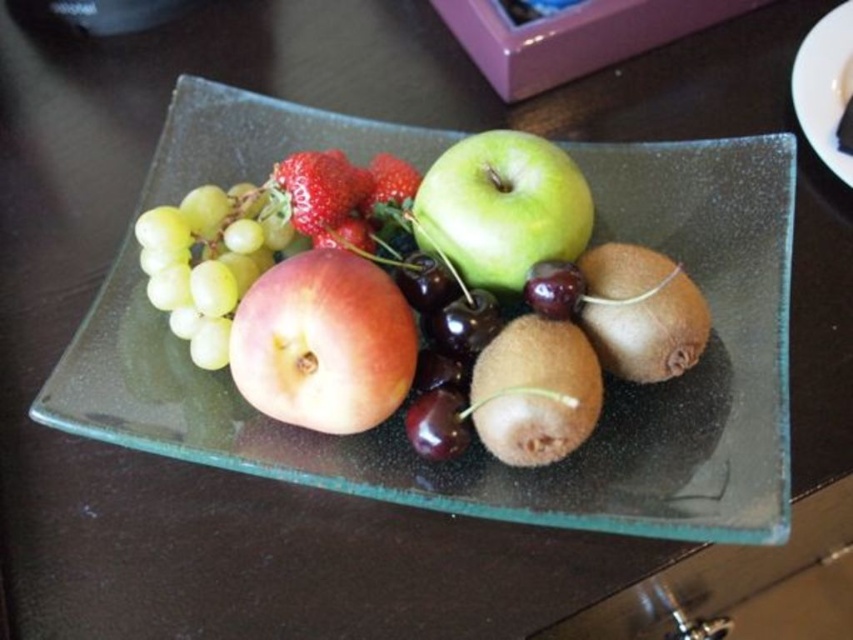
How distant is transparent glass platter at center from white glossy plate at upper right?

They are 15.37 inches apart.

Can you confirm if transparent glass platter at center is positioned above white glossy plate at upper right?

Actually, transparent glass platter at center is below white glossy plate at upper right.

Who is more forward, (190, 154) or (843, 4)?

Point (843, 4) is in front.

Identify the location of transparent glass platter at center. (479, 448).

Is green matte grapes at upper left to the left of white glossy plate at upper right from the viewer's perspective?

Indeed, green matte grapes at upper left is positioned on the left side of white glossy plate at upper right.

Can you confirm if green matte grapes at upper left is smaller than white glossy plate at upper right?

Actually, green matte grapes at upper left might be larger than white glossy plate at upper right.

I want to click on green matte grapes at upper left, so click(x=210, y=259).

Can you confirm if transparent glass platter at center is bigger than brown fuzzy kiwi at center?

Correct, transparent glass platter at center is larger in size than brown fuzzy kiwi at center.

Is point (282, 444) farther from camera compared to point (554, 340)?

Yes, point (282, 444) is behind point (554, 340).

Who is more distant from viewer, (518, 472) or (560, 381)?

Point (518, 472)

What are the coordinates of `transparent glass platter at center` in the screenshot? It's located at pyautogui.click(x=479, y=448).